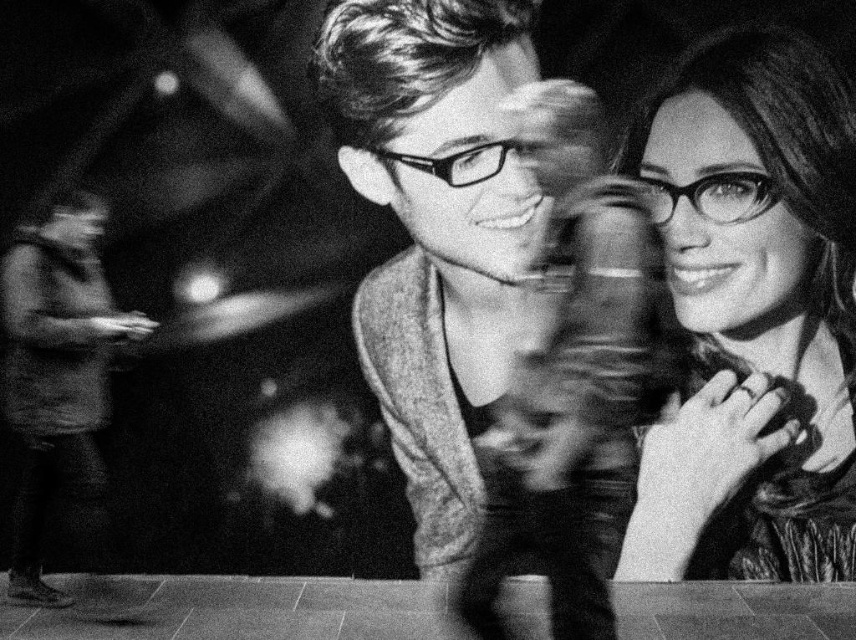
You are a photographer who wants to adjust the focus of your camera to capture the matte black glasses at upper right located at point (752, 314). Based on the scene, where should you focus your camera?

The matte black glasses at upper right are located at point (752, 314), so you should focus your camera at that point to capture them clearly.

You are a photographer who wants to capture a closeup of the smooth leather jacket at center and the smooth fabric shirt at lower left. Which object should you adjust your camera focus to first to ensure both are in focus?

The smooth leather jacket at center is above the smooth fabric shirt at lower left, so you should focus on the smooth fabric shirt at lower left first since it is closer to the camera. This way, the smooth leather jacket at center, being further away, will still be in focus if the depth of field is adjusted properly.

You are a photographer who wants to adjust the focus of your camera to ensure both the matte black glasses at upper right and the smooth fabric shirt at lower left are in sharp focus. Given their height difference, which object should you focus on to achieve this?

The matte black glasses at upper right is much taller than the smooth fabric shirt at lower left. To ensure both are in focus, you should focus on the matte black glasses at upper right since it is the farther object and adjusting focus there would increase the depth of field coverage for both.